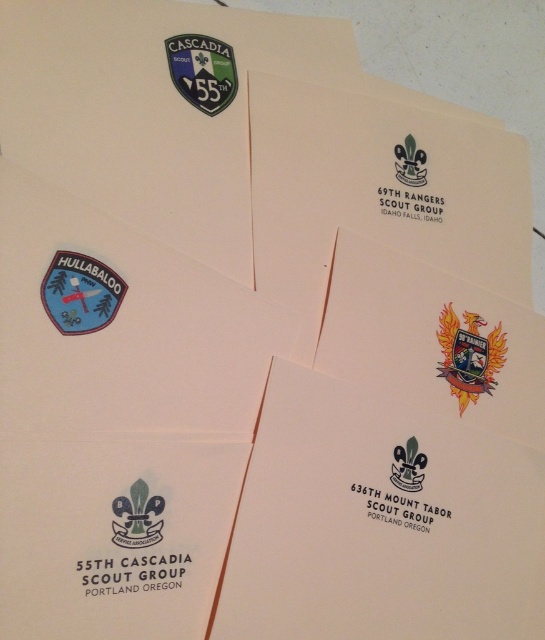
Which is in front, point (134, 492) or point (407, 140)?

Point (134, 492)

Is point (130, 502) positioned before point (411, 177)?

Yes.

Measure the distance between green matte logo at lower left and camera.

A distance of 30.94 inches exists between green matte logo at lower left and camera.

Locate an element on the screen. The width and height of the screenshot is (545, 640). green matte logo at lower left is located at coordinates (137, 516).

Based on the photo, does blue fabric patch at lower left have a larger size compared to white matte fleur-de-lis at upper center?

Yes.

Find the location of a particular element. blue fabric patch at lower left is located at coordinates (81, 292).

Between point (58, 301) and point (408, 177), which one is positioned in front?

Point (58, 301) is in front.

Find the location of a particular element. Image resolution: width=545 pixels, height=640 pixels. blue fabric patch at lower left is located at coordinates (81, 292).

Does green matte patch at upper left appear on the right side of white matte fleur-de-lis at center?

Incorrect, green matte patch at upper left is not on the right side of white matte fleur-de-lis at center.

Find the location of `green matte patch at upper left`. green matte patch at upper left is located at coordinates (202, 70).

Is point (185, 68) positioned after point (419, 472)?

No.

Identify the location of green matte patch at upper left. Image resolution: width=545 pixels, height=640 pixels. (202, 70).